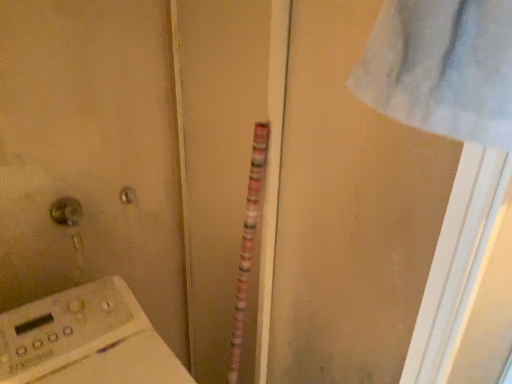
Locate an element on the screen. This screenshot has height=384, width=512. pink striped screen door at center is located at coordinates (350, 214).

Describe the element at coordinates (350, 214) in the screenshot. I see `pink striped screen door at center` at that location.

Locate an element on the screen. pink striped screen door at center is located at coordinates (350, 214).